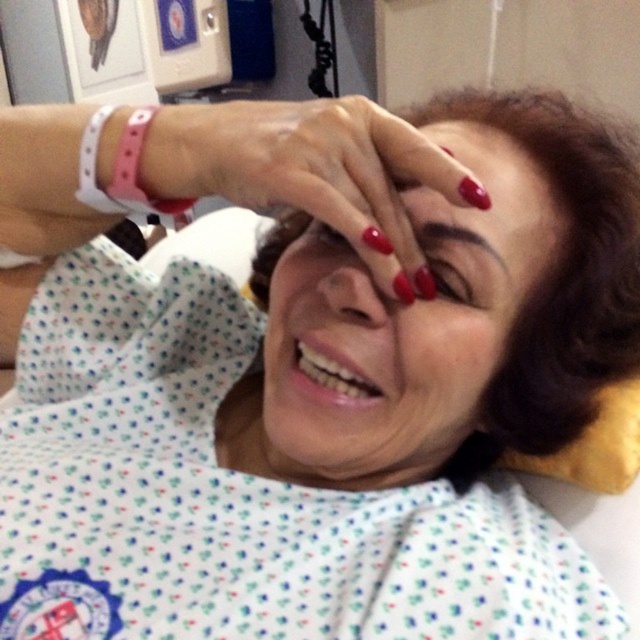
Who is more distant from viewer, (444, 260) or (344, 241)?

The point (344, 241) is more distant.

Is point (449, 273) closer to viewer compared to point (323, 224)?

Yes, it is in front of point (323, 224).

Who is more distant from viewer, [433,276] or [310,224]?

Point [310,224]

At what (x,y) coordinates should I click in order to perform the action: click on matte skin eye at center. Please return your answer as a coordinate pair (x, y). This screenshot has height=640, width=640. Looking at the image, I should click on (452, 275).

Which is more to the left, matte red nails at center or glossy red nails at center?

glossy red nails at center

Can you confirm if matte red nails at center is positioned to the left of glossy red nails at center?

No, matte red nails at center is not to the left of glossy red nails at center.

I want to click on matte red nails at center, so click(403, 326).

Does glossy red nails at center appear under pink rubber band at upper left?

Yes.

Looking at this image, is glossy red nails at center shorter than pink rubber band at upper left?

No.

The image size is (640, 640). What do you see at coordinates (317, 172) in the screenshot?
I see `glossy red nails at center` at bounding box center [317, 172].

The height and width of the screenshot is (640, 640). Find the location of `glossy red nails at center`. glossy red nails at center is located at coordinates (317, 172).